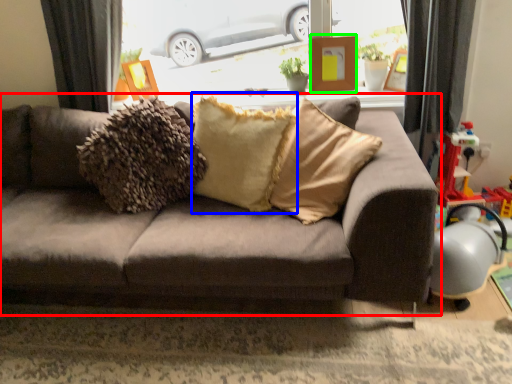
Question: Based on their relative distances, which object is nearer to studio couch (highlighted by a red box)? Choose from pillow (highlighted by a blue box) and picture frame (highlighted by a green box).

Choices:
 (A) pillow
 (B) picture frame

Answer: (A)